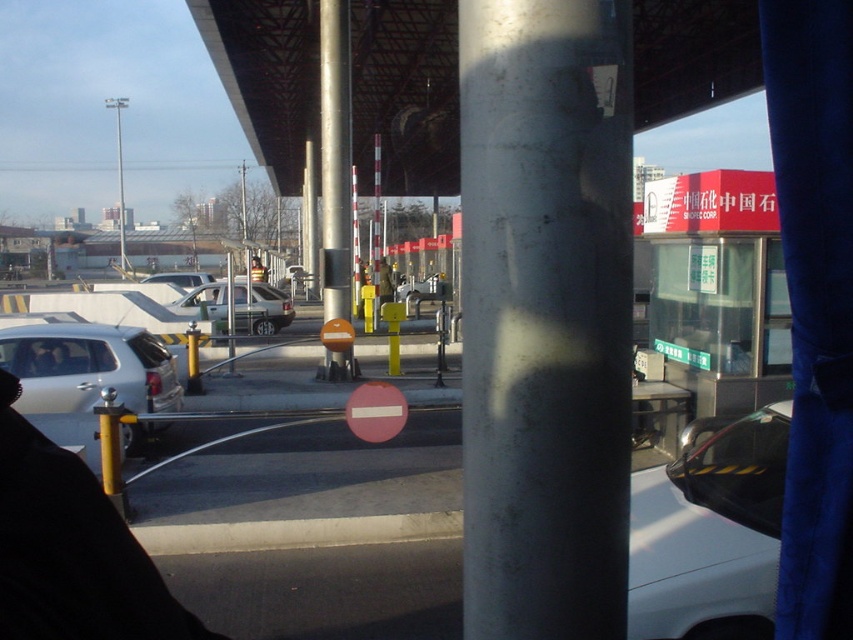
Question: Which object appears farthest from the camera in this image?

Choices:
 (A) silver metallic sedan at center
 (B) red matte stop sign at center

Answer: (A)

Question: Which of these objects is positioned farthest from the silver metallic sedan at left?

Choices:
 (A) red matte stop sign at center
 (B) metallic glass booth at center right

Answer: (B)

Question: Does white glossy car at center have a smaller size compared to silver metallic sedan at center?

Choices:
 (A) yes
 (B) no

Answer: (A)

Question: Among these objects, which one is nearest to the camera?

Choices:
 (A) metallic glass booth at center right
 (B) silver metallic sedan at center
 (C) silver metallic pole at center

Answer: (A)

Question: Does dark gray fabric person at center have a lesser width compared to matte silver sedan at center?

Choices:
 (A) no
 (B) yes

Answer: (B)

Question: Does white glossy car at center come behind red matte stop sign at center?

Choices:
 (A) no
 (B) yes

Answer: (A)